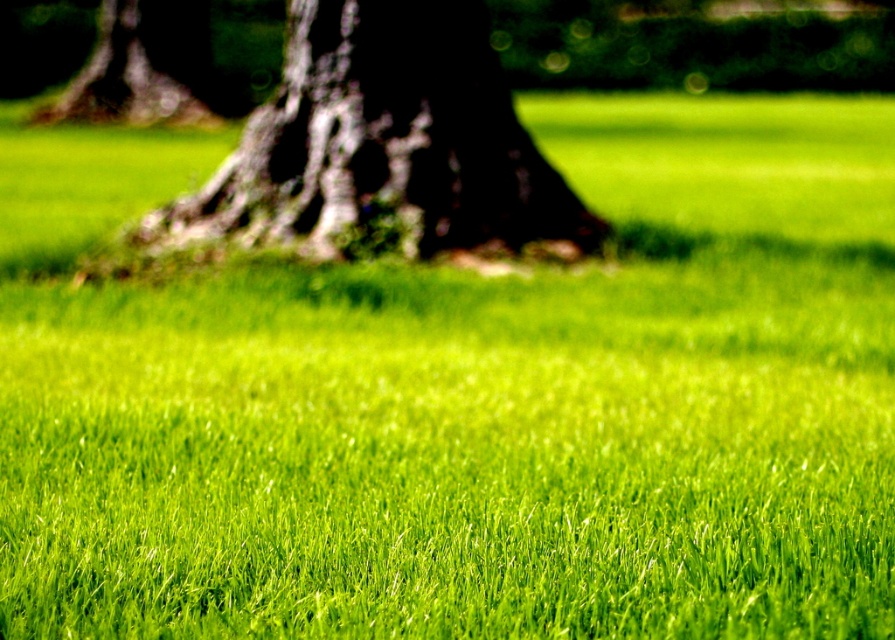
You are a photographer who wants to capture a closeup of the dark brown textured trunk at center and the dark brown bark at upper left. Which object is closer to the camera?

The dark brown textured trunk at center is positioned under the dark brown bark at upper left, meaning it is closer to the camera.

You are a photographer who wants to take a picture of the dark brown textured trunk at center. The camera is currently focused at point coordinates of 0.223, 0.429. Is the trunk in focus?

The position of dark brown textured trunk at center is at point [382,141], so yes, the trunk is in focus because the camera is focused at that exact coordinate.

You are standing in a grassy field and want to take a photo with your phone. You see a dark brown textured trunk at center at point (382, 141). Can you tell me the exact coordinates of the dark brown textured trunk at center?

The dark brown textured trunk at center is located exactly at point (382, 141).